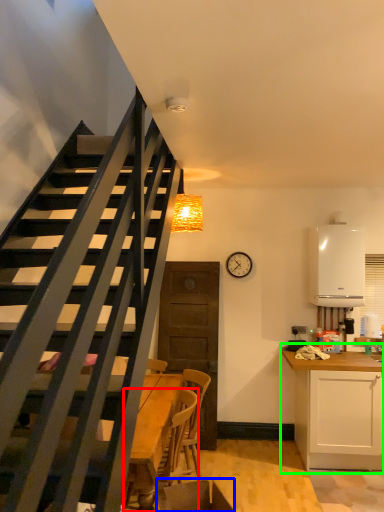
Question: Considering the real-world distances, which object is farthest from chair (highlighted by a red box)? swivel chair (highlighted by a blue box) or cabinetry (highlighted by a green box)?

Choices:
 (A) swivel chair
 (B) cabinetry

Answer: (B)